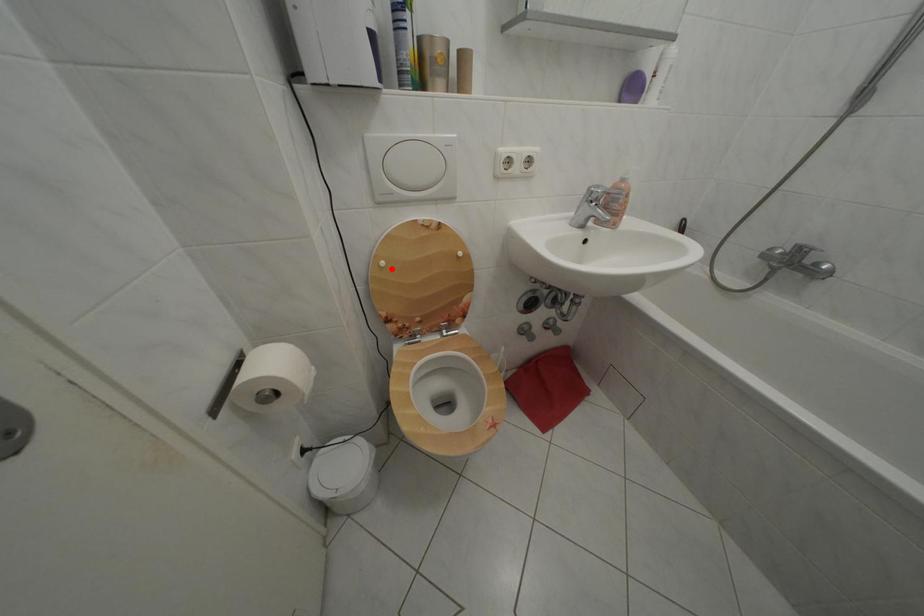
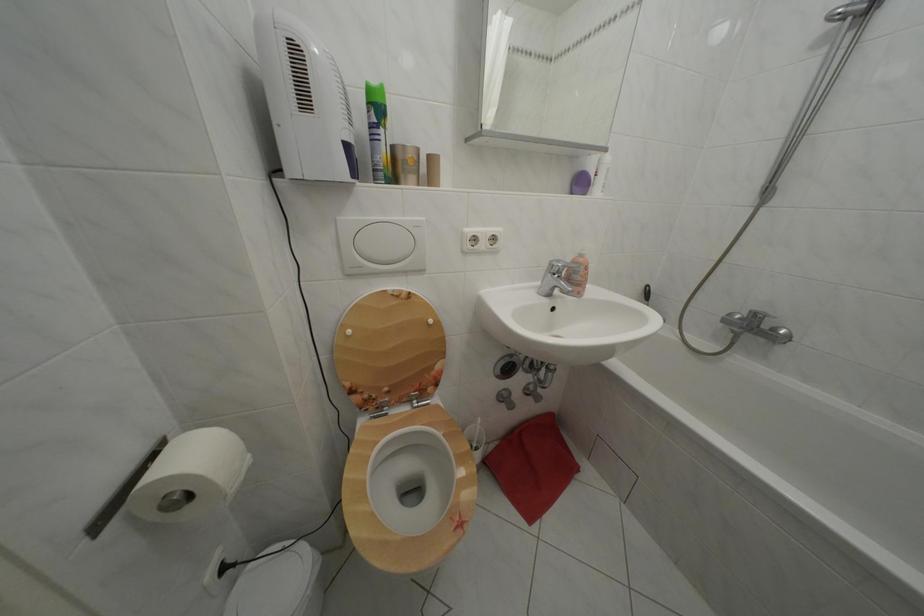
Question: I am providing you with two images of the same scene from different viewpoints. Image1 has a red point marked. In image2, the corresponding 3D location appears at what relative position? Reply with the corresponding letter.

Choices:
 (A) Closer
 (B) Farther

Answer: (B)